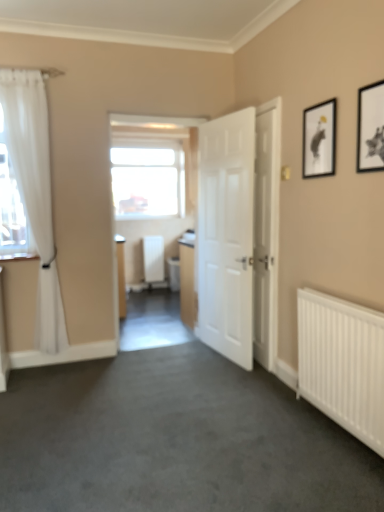
Question: Considering the relative sizes of transparent glass window at center and white wooden door at right, the 1th door from the right, in the image provided, is transparent glass window at center taller than white wooden door at right, the 1th door from the right,?

Choices:
 (A) yes
 (B) no

Answer: (B)

Question: From the image's perspective, is transparent glass window at center located above white wooden door at right, the 1th door from the right?

Choices:
 (A) no
 (B) yes

Answer: (B)

Question: Can you confirm if transparent glass window at center is positioned to the left of white wooden door at right, which is the 2th door from left to right?

Choices:
 (A) no
 (B) yes

Answer: (B)

Question: Considering the relative positions of transparent glass window at center and white wooden door at right, the 1th door from the right, in the image provided, is transparent glass window at center to the right of white wooden door at right, the 1th door from the right, from the viewer's perspective?

Choices:
 (A) yes
 (B) no

Answer: (B)

Question: Are transparent glass window at center and white wooden door at right, the 1th door from the right, far apart?

Choices:
 (A) no
 (B) yes

Answer: (B)

Question: Would you say white sheer curtain at left is inside or outside white metal radiator at lower right, marked as the 2th radiator in a back-to-front arrangement?

Choices:
 (A) inside
 (B) outside

Answer: (B)

Question: From their relative heights in the image, would you say white sheer curtain at left is taller or shorter than white metal radiator at lower right, marked as the 2th radiator in a back-to-front arrangement?

Choices:
 (A) short
 (B) tall

Answer: (B)

Question: From a real-world perspective, relative to white metal radiator at lower right, marked as the 2th radiator in a back-to-front arrangement, is white sheer curtain at left vertically above or below?

Choices:
 (A) above
 (B) below

Answer: (A)

Question: Considering the positions of white sheer curtain at left and white metal radiator at lower right, the 2th radiator from the left, in the image, is white sheer curtain at left bigger or smaller than white metal radiator at lower right, the 2th radiator from the left,?

Choices:
 (A) big
 (B) small

Answer: (A)

Question: From a real-world perspective, is white matte radiator at center, the second radiator viewed from the right, physically located above or below black matte picture frame at upper right, which is the 1th picture frame in front-to-back order?

Choices:
 (A) above
 (B) below

Answer: (B)

Question: Considering the positions of white matte radiator at center, positioned as the 1th radiator in back-to-front order, and black matte picture frame at upper right, marked as the 1th picture frame in a right-to-left arrangement, in the image, is white matte radiator at center, positioned as the 1th radiator in back-to-front order, bigger or smaller than black matte picture frame at upper right, marked as the 1th picture frame in a right-to-left arrangement,?

Choices:
 (A) small
 (B) big

Answer: (B)

Question: Which is correct: white matte radiator at center, acting as the 2th radiator starting from the front, is inside black matte picture frame at upper right, marked as the second picture frame in a left-to-right arrangement, or outside of it?

Choices:
 (A) outside
 (B) inside

Answer: (A)

Question: Considering the positions of white matte radiator at center, the first radiator from the left, and black matte picture frame at upper right, marked as the 1th picture frame in a right-to-left arrangement, in the image, is white matte radiator at center, the first radiator from the left, taller or shorter than black matte picture frame at upper right, marked as the 1th picture frame in a right-to-left arrangement,?

Choices:
 (A) short
 (B) tall

Answer: (B)

Question: In terms of width, does black matte picture frame at upper right, which is the 1th picture frame in front-to-back order, look wider or thinner when compared to transparent glass window at center?

Choices:
 (A) thin
 (B) wide

Answer: (A)

Question: In the image, is black matte picture frame at upper right, marked as the 1th picture frame in a right-to-left arrangement, on the left side or the right side of transparent glass window at center?

Choices:
 (A) left
 (B) right

Answer: (B)